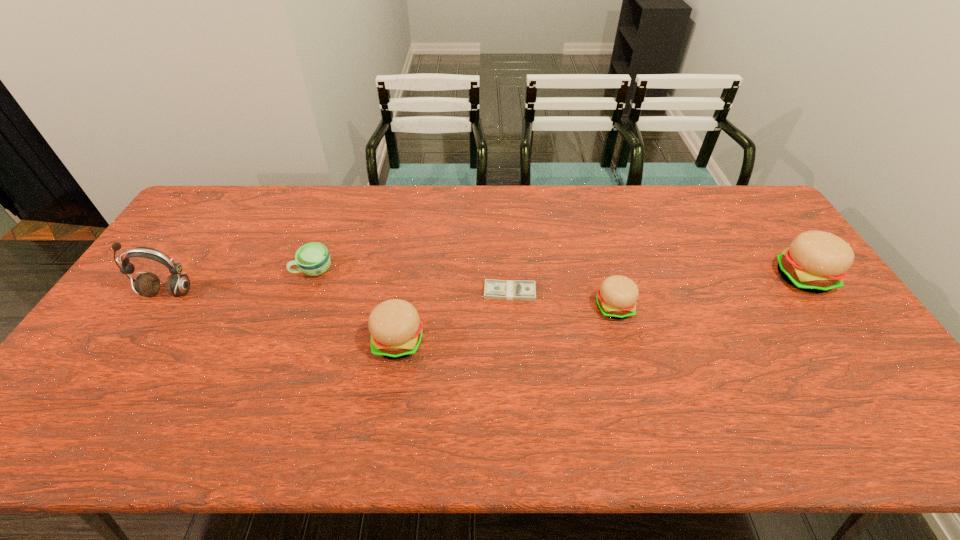
Locate an element on the screen. This screenshot has height=540, width=960. free space between the shortest object and the cup is located at coordinates (412, 281).

This screenshot has height=540, width=960. Identify the location of free spot between the shortest hamburger and the rightmost object. (708, 293).

Locate an element on the screen. The width and height of the screenshot is (960, 540). empty space that is in between the earphone and the fifth object from right to left is located at coordinates (241, 281).

The width and height of the screenshot is (960, 540). I want to click on free space between the third object from left to right and the tallest object, so click(283, 318).

You are a GUI agent. You are given a task and a screenshot of the screen. Output one action in this format:
    pyautogui.click(x=<x>, y=<y>)
    Task: Click on the empty space that is in between the second object from left to right and the leftmost object
    The height and width of the screenshot is (540, 960).
    Given the screenshot: What is the action you would take?
    pyautogui.click(x=241, y=281)

Where is `object that is the fourth closest to the tallest object`? This screenshot has width=960, height=540. object that is the fourth closest to the tallest object is located at coordinates (616, 298).

At what (x,y) coordinates should I click in order to perform the action: click on object that is the third closest to the shortest hamburger. Please return your answer as a coordinate pair (x, y). Image resolution: width=960 pixels, height=540 pixels. Looking at the image, I should click on (396, 330).

Point out which hamburger is positioned as the second nearest to the leftmost object. Please provide its 2D coordinates. Your answer should be formatted as a tuple, i.e. [(x, y)], where the tuple contains the x and y coordinates of a point satisfying the conditions above.

[(616, 298)]

Identify the location of the second closest hamburger to the second object from right to left. (396, 330).

Image resolution: width=960 pixels, height=540 pixels. Identify the location of free space that satisfies the following two spatial constraints: 1. on the front side of the fifth tallest object; 2. on the right side of the leftmost hamburger. (287, 342).